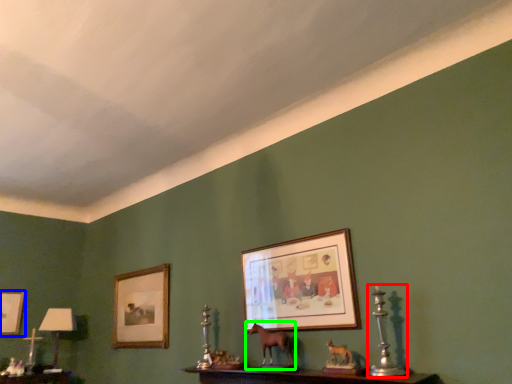
Question: Which is nearer to the candle holder (highlighted by a red box)? picture frame (highlighted by a blue box) or animal (highlighted by a green box).

Choices:
 (A) picture frame
 (B) animal

Answer: (B)